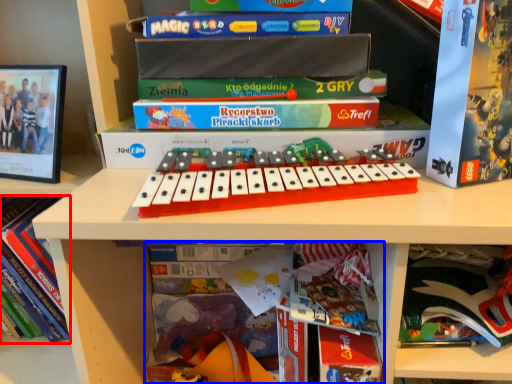
Question: Which point is further to the camera, book (highlighted by a red box) or book (highlighted by a blue box)?

Choices:
 (A) book
 (B) book

Answer: (A)